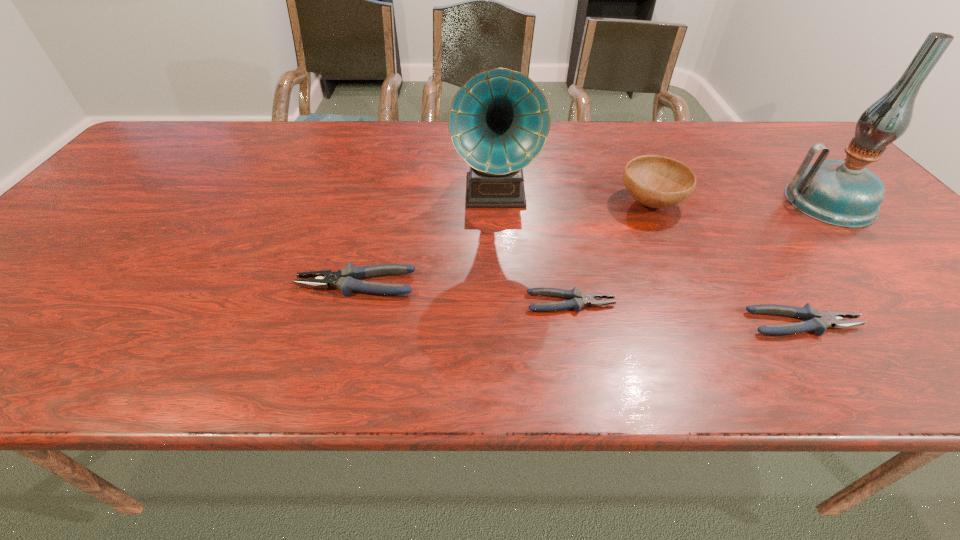
Locate an element on the screen. The width and height of the screenshot is (960, 540). free location located at the gripping part of the leftmost pliers is located at coordinates (188, 284).

Locate an element on the screen. free space located at the gripping part of the leftmost pliers is located at coordinates (259, 284).

At what (x,y) coordinates should I click in order to perform the action: click on vacant area located 0.140m at the gripping part of the shortest pliers. Please return your answer as a coordinate pair (x, y). This screenshot has height=540, width=960. Looking at the image, I should click on (684, 303).

You are a GUI agent. You are given a task and a screenshot of the screen. Output one action in this format:
    pyautogui.click(x=<x>, y=<y>)
    Task: Click on the vacant area situated at the gripping part of the second shortest object
    
    Given the screenshot: What is the action you would take?
    (895, 323)

At what (x,y) coordinates should I click in order to perform the action: click on vacant space located 0.160m on the front of the rightmost object. Please return your answer as a coordinate pair (x, y). Looking at the image, I should click on (895, 276).

At what (x,y) coordinates should I click in order to perform the action: click on free region located on the back of the bowl. Please return your answer as a coordinate pair (x, y). The image size is (960, 540). Looking at the image, I should click on (614, 122).

This screenshot has height=540, width=960. I want to click on vacant space located 0.220m from the horn of the phonograph_record, so point(499,291).

Find the location of a particular element. object that is at the right edge is located at coordinates (842, 193).

You are a GUI agent. You are given a task and a screenshot of the screen. Output one action in this format:
    pyautogui.click(x=<x>, y=<y>)
    Task: Click on the free space at the far edge of the desktop
    
    Given the screenshot: What is the action you would take?
    pyautogui.click(x=608, y=158)

In the image, there is a desktop. At what (x,y) coordinates should I click in order to perform the action: click on vacant region at the near edge. Please return your answer as a coordinate pair (x, y). The image size is (960, 540). Looking at the image, I should click on tap(516, 310).